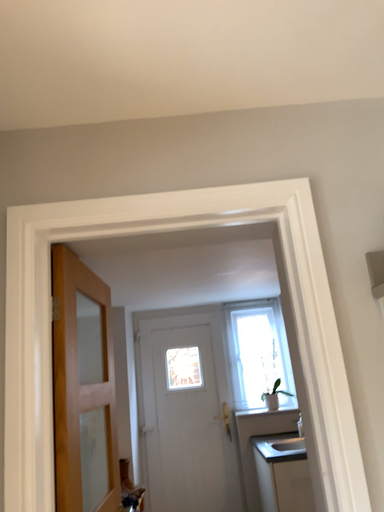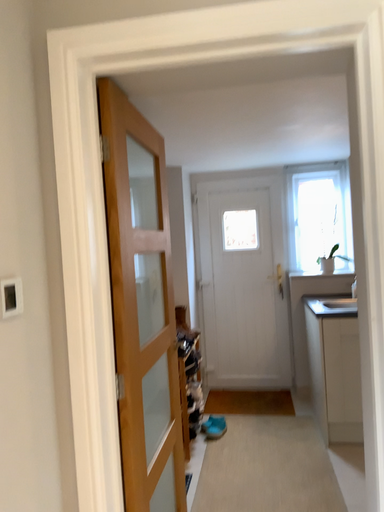
Question: How did the camera likely rotate when shooting the video?

Choices:
 (A) rotated right
 (B) rotated left

Answer: (B)